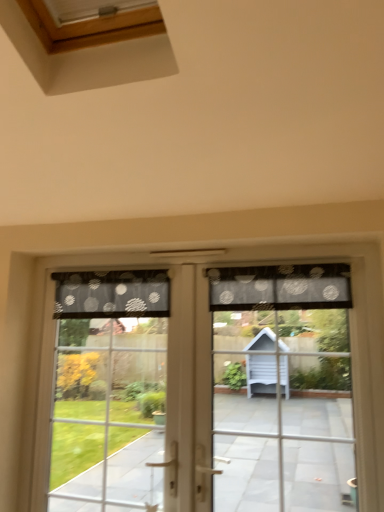
What are the coordinates of `free point above black dotted fabric at upper center, acting as the first curtain starting from the left (from a real-world perspective)` in the screenshot? It's located at (101, 265).